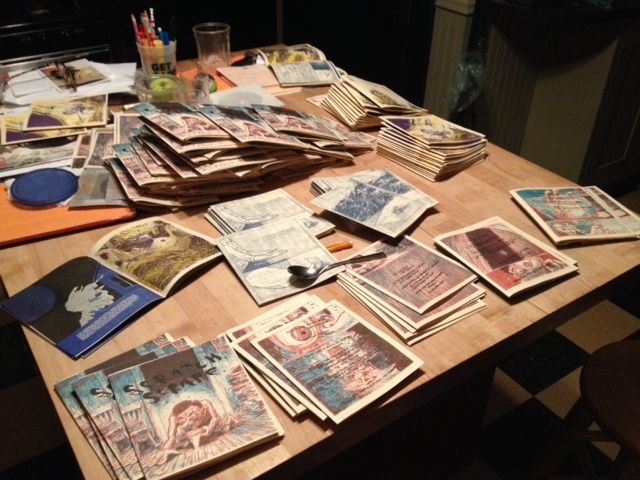
Find the location of a particular element. This screenshot has height=480, width=640. glass is located at coordinates [x=220, y=48].